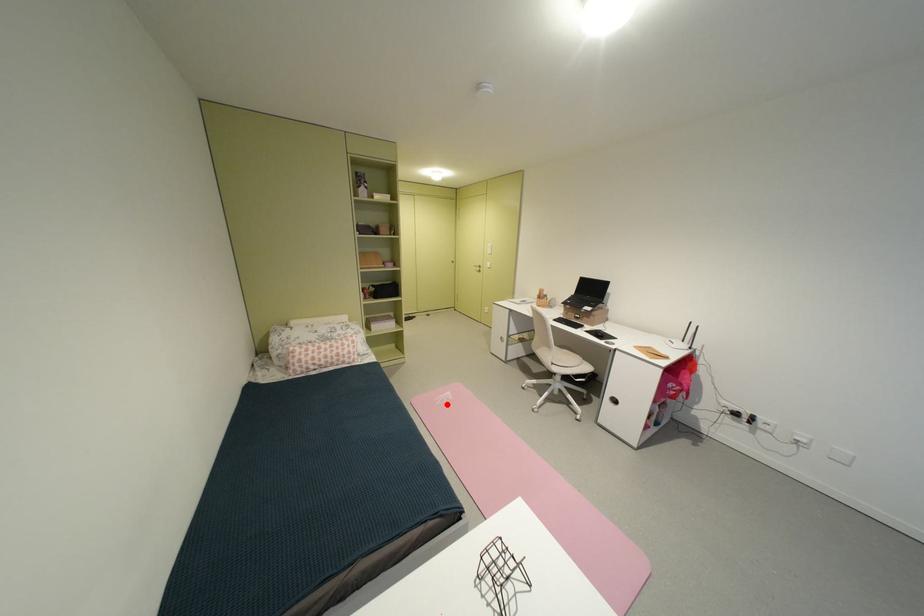
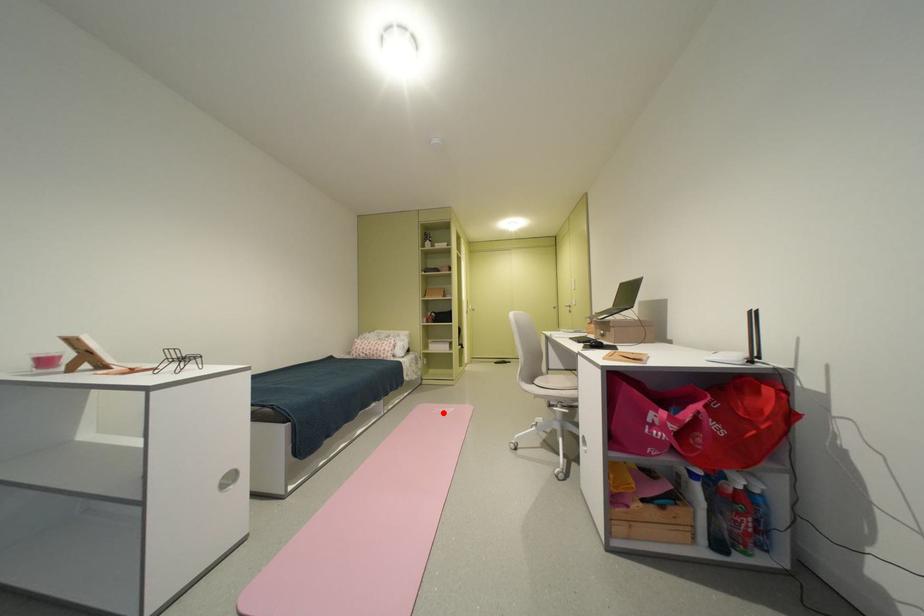
I am providing you with two images of the same scene from different viewpoints. A red point is marked on the first image and another point is marked on the second image. Does the point marked in image1 correspond to the same location as the one in image2?

Yes